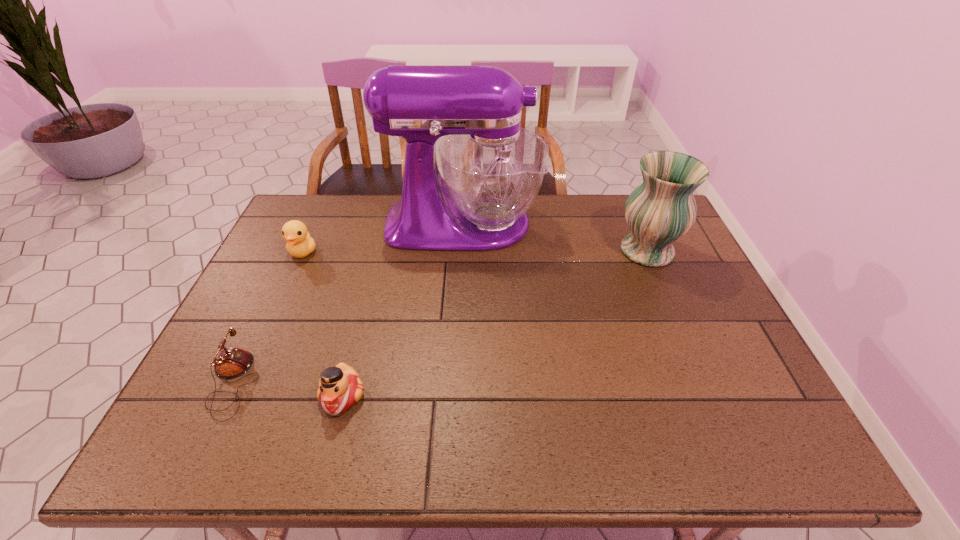
You are a GUI agent. You are given a task and a screenshot of the screen. Output one action in this format:
    pyautogui.click(x=<x>, y=<y>)
    Task: Click on the vacant space located on the rotary dial of the telephone
    Image resolution: width=960 pixels, height=540 pixels.
    Given the screenshot: What is the action you would take?
    pyautogui.click(x=388, y=382)

Identify the location of mixer that is at the far edge. (492, 169).

The height and width of the screenshot is (540, 960). I want to click on vase at the far edge, so click(x=661, y=210).

Locate an element on the screen. The width and height of the screenshot is (960, 540). duck situated at the near edge is located at coordinates (x=340, y=387).

Locate an element on the screen. The width and height of the screenshot is (960, 540). telephone that is at the near edge is located at coordinates (231, 363).

At what (x,y) coordinates should I click in order to perform the action: click on duck at the left edge. Please return your answer as a coordinate pair (x, y). The image size is (960, 540). Looking at the image, I should click on (299, 244).

Identify the location of telephone positioned at the left edge. (231, 363).

The height and width of the screenshot is (540, 960). Find the location of `object at the right edge`. object at the right edge is located at coordinates (661, 210).

Identify the location of object that is at the near left corner. Image resolution: width=960 pixels, height=540 pixels. (231, 363).

You are a GUI agent. You are given a task and a screenshot of the screen. Output one action in this format:
    pyautogui.click(x=<x>, y=<y>)
    Task: Click on the object present at the far right corner
    
    Given the screenshot: What is the action you would take?
    pyautogui.click(x=661, y=210)